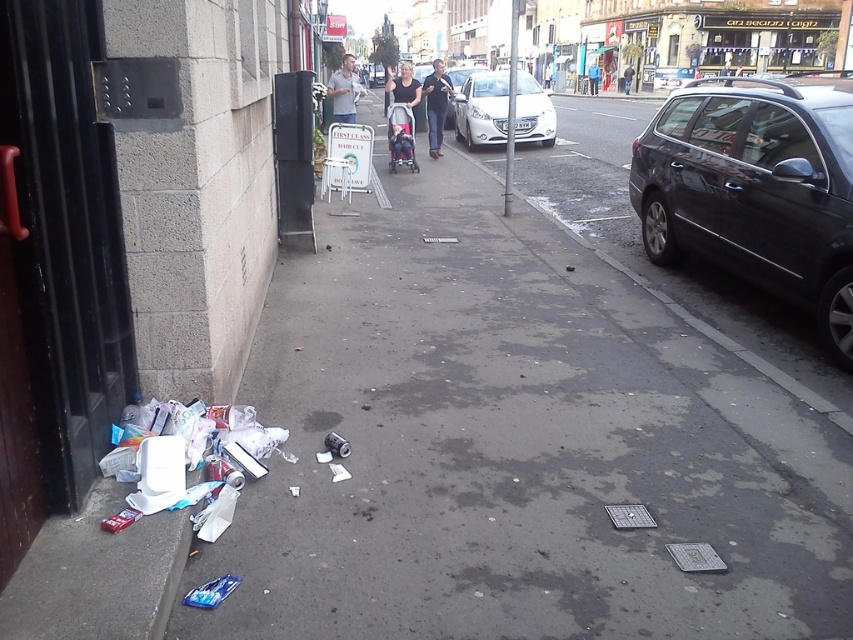
Based on the photo, who is higher up, white glossy sedan at center or red fabric baby carriage at center?

white glossy sedan at center is above.

Does white glossy sedan at center have a lesser height compared to red fabric baby carriage at center?

Correct, white glossy sedan at center is not as tall as red fabric baby carriage at center.

Is point (479, 140) farther from camera compared to point (389, 145)?

Yes.

Where is `white glossy sedan at center`? white glossy sedan at center is located at coordinates (482, 108).

Is point (782, 184) in front of point (228, 520)?

No, it is not.

Is black glossy car at right closer to camera compared to plastic bag at lower left?

No, black glossy car at right is further to the viewer.

Between point (662, 124) and point (218, 417), which one is positioned in front?

Positioned in front is point (218, 417).

This screenshot has width=853, height=640. I want to click on black glossy car at right, so click(756, 189).

Is the position of white paper at left less distant than that of white glossy sedan at center?

That is True.

Who is taller, white paper at left or white glossy sedan at center?

With more height is white glossy sedan at center.

Who is more distant from viewer, (585, 467) or (492, 132)?

The point (492, 132) is more distant.

I want to click on white paper at left, so click(515, 445).